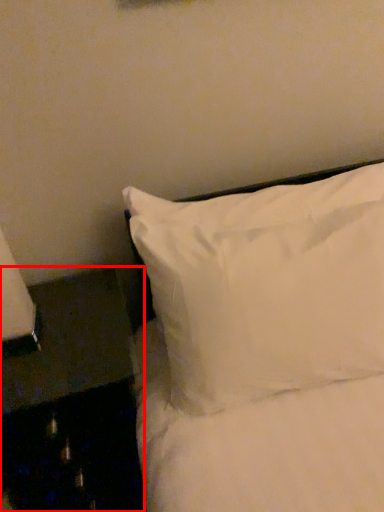
Question: From the image, what is the correct spatial relationship of furniture (annotated by the red box) in relation to pillow?

Choices:
 (A) right
 (B) left

Answer: (B)